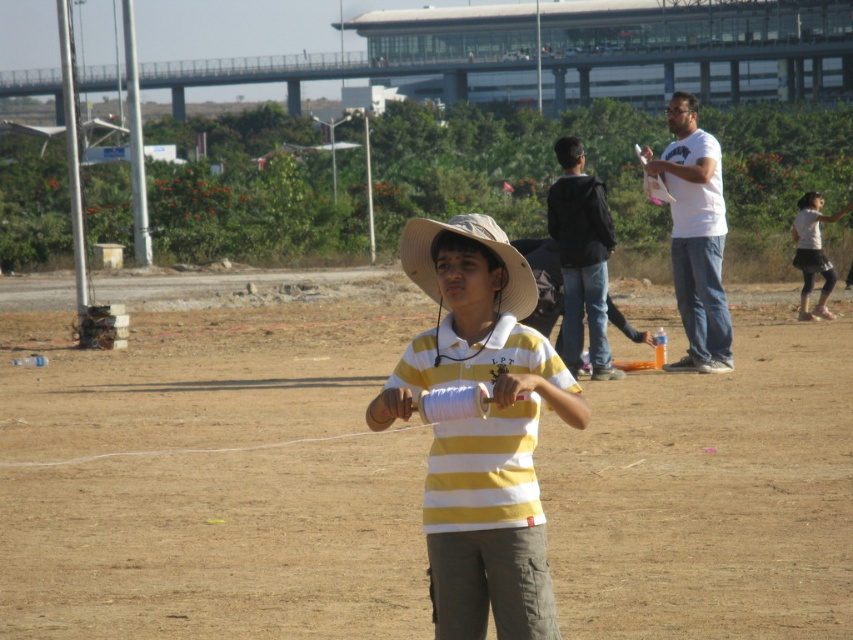
Question: Among these points, which one is farthest from the camera?

Choices:
 (A) (479, 232)
 (B) (178, 488)
 (C) (602, 195)

Answer: (C)

Question: Is yellow striped shirt at center bigger than black matte jacket at upper right?

Choices:
 (A) yes
 (B) no

Answer: (B)

Question: Which object is the farthest from the black matte jacket at upper right?

Choices:
 (A) brown dirt field at center
 (B) tan straw hat at center
 (C) yellow striped shirt at center

Answer: (C)

Question: Which object appears farthest from the camera in this image?

Choices:
 (A) brown dirt field at center
 (B) yellow striped shirt at center

Answer: (A)

Question: Can you confirm if brown dirt field at center is positioned to the left of white cotton shirt at right?

Choices:
 (A) yes
 (B) no

Answer: (A)

Question: Observing the image, what is the correct spatial positioning of tan straw hat at center in reference to white cotton shirt at right?

Choices:
 (A) left
 (B) right

Answer: (A)